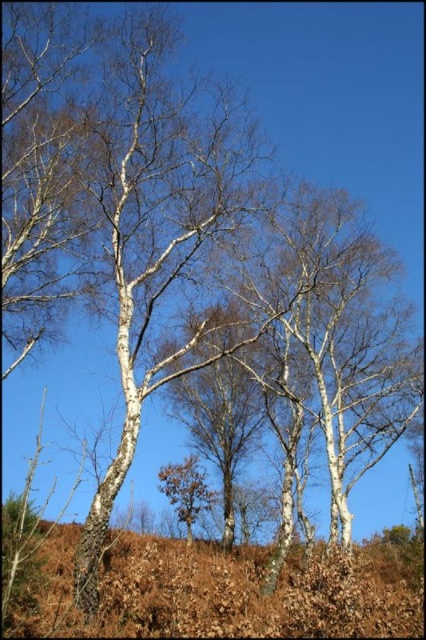
This screenshot has height=640, width=426. What do you see at coordinates (244, 595) in the screenshot? I see `brown dry grass at lower center` at bounding box center [244, 595].

Which is behind, point (106, 621) or point (195, 464)?

The point (195, 464) is behind.

Find the location of a particular element. brown dry grass at lower center is located at coordinates (244, 595).